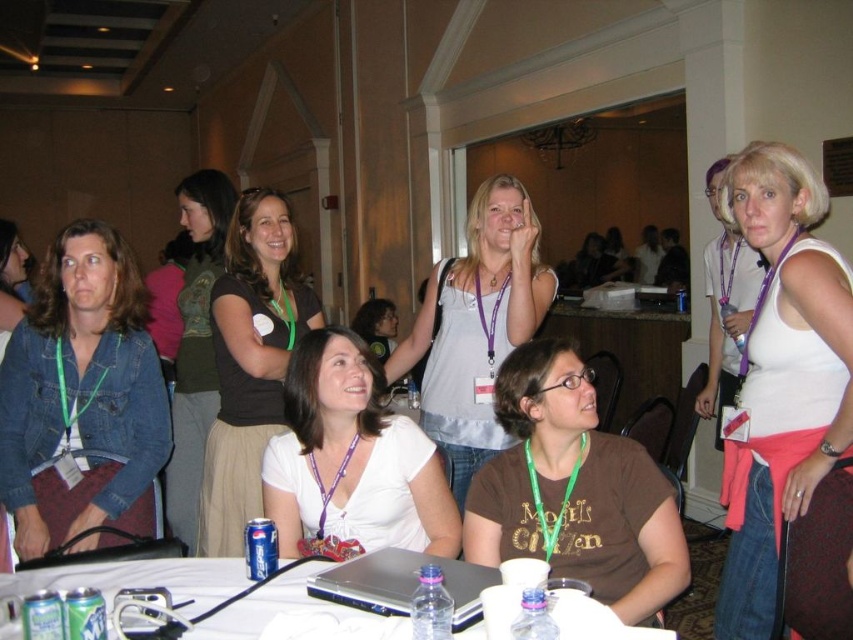
Question: Can you confirm if matte black shirt at upper center is positioned to the right of white plastic table at lower center?

Choices:
 (A) yes
 (B) no

Answer: (B)

Question: Considering the real-world distances, which object is closest to the matte black shirt at upper center?

Choices:
 (A) white plastic table at lower center
 (B) white matte tank top at center
 (C) dark green jersey at center
 (D) light gray tank top at center

Answer: (C)

Question: Is light gray tank top at center smaller than dark green jersey at center?

Choices:
 (A) yes
 (B) no

Answer: (A)

Question: Which object is the farthest from the matte black shirt at upper center?

Choices:
 (A) light gray tank top at center
 (B) brown cotton t-shirt at center
 (C) denim jacket at left

Answer: (B)

Question: Is white matte tank top at center below light gray tank top at center?

Choices:
 (A) yes
 (B) no

Answer: (A)

Question: Which point is closer to the camera?

Choices:
 (A) dark green jersey at center
 (B) brown cotton t-shirt at center

Answer: (B)